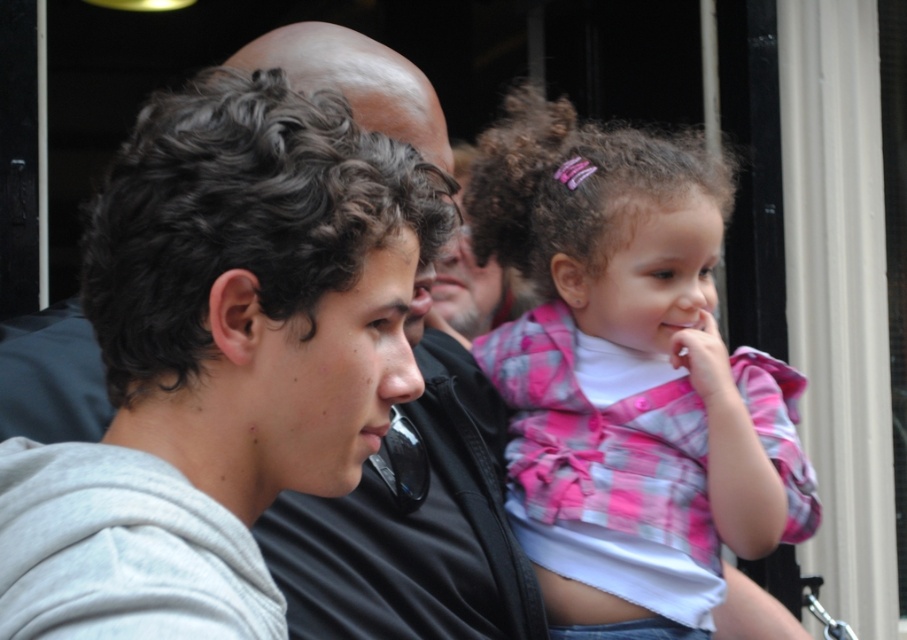
You are a photographer trying to capture a group photo of the pink plaid shirt at center and the gray hoodie at center. If you want to ensure both subjects are fully visible in the frame, which subject requires more horizontal space due to their clothing size?

The pink plaid shirt at center requires more horizontal space because its width surpasses that of the gray hoodie at center.

You are a photographer trying to adjust the lighting for a group photo. You notice the pink plaid shirt at center and the gray hoodie at center. Which clothing item is positioned higher in the image?

The pink plaid shirt at center is located above the gray hoodie at center, so it is positioned higher in the image.